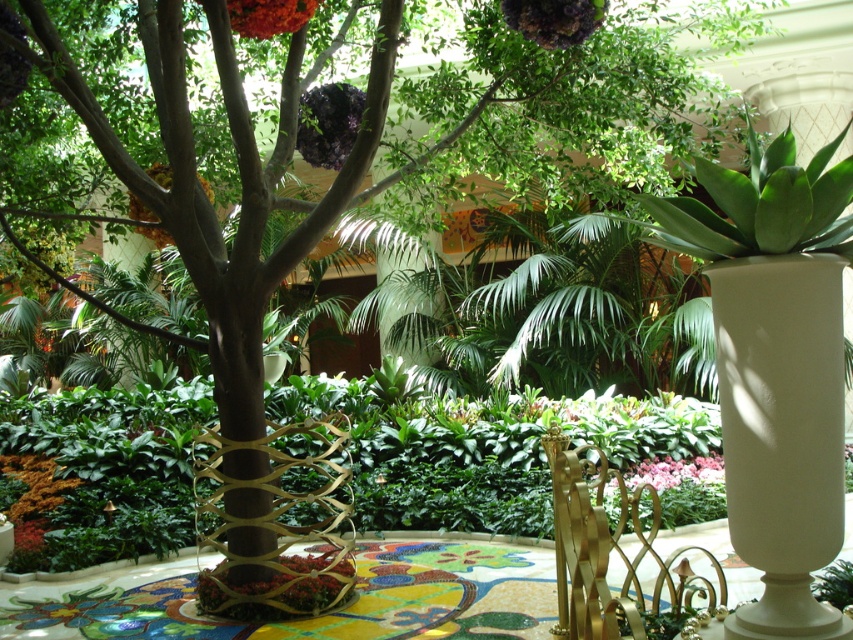
Question: Is white glossy vase at right wider than shiny orange flower at upper center?

Choices:
 (A) no
 (B) yes

Answer: (B)

Question: Among these objects, which one is nearest to the camera?

Choices:
 (A) red velvet flower at center
 (B) shiny purple flower at upper center

Answer: (A)

Question: Which point is closer to the camera taking this photo?

Choices:
 (A) (343, 600)
 (B) (244, 16)
 (C) (160, 230)
 (D) (645, 468)

Answer: (B)

Question: Considering the relative positions of red velvet flower at center and shiny orange flower at upper center in the image provided, where is red velvet flower at center located with respect to shiny orange flower at upper center?

Choices:
 (A) left
 (B) right

Answer: (A)

Question: Estimate the real-world distances between objects in this image. Which object is farther from the orange fuzzy flower at lower left?

Choices:
 (A) red velvet flower at center
 (B) white glossy vase at right

Answer: (B)

Question: Is orange fuzzy flower at lower left smaller than pink matte flowers at center?

Choices:
 (A) no
 (B) yes

Answer: (A)